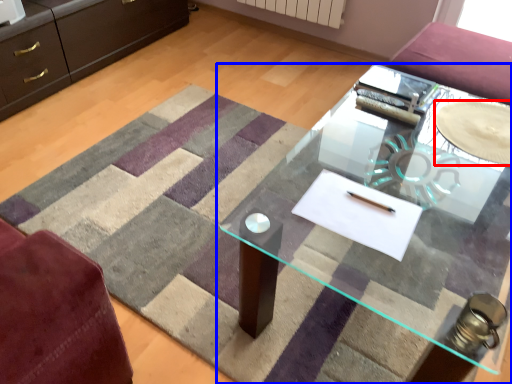
Question: Which object is further to the camera taking this photo, glass plate (highlighted by a red box) or table (highlighted by a blue box)?

Choices:
 (A) glass plate
 (B) table

Answer: (A)